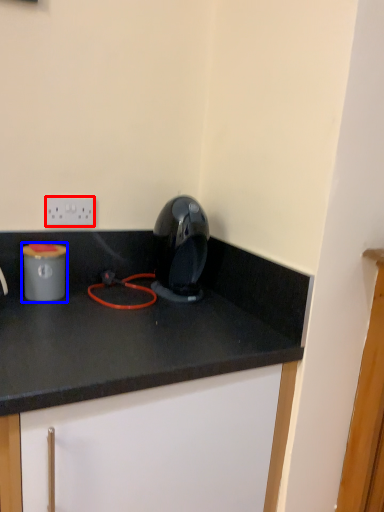
Question: Which object appears farthest to the camera in this image, electric outlet (highlighted by a red box) or appliance (highlighted by a blue box)?

Choices:
 (A) electric outlet
 (B) appliance

Answer: (A)